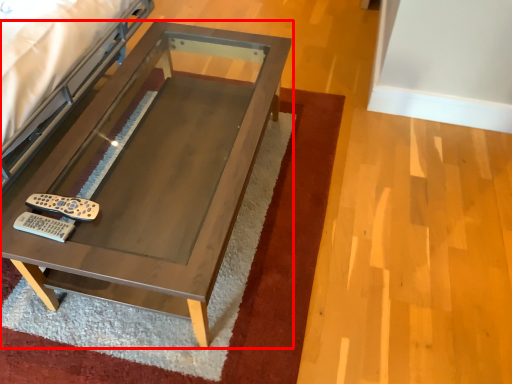
Question: From the image's perspective, where is table (annotated by the red box) located relative to remote?

Choices:
 (A) below
 (B) above

Answer: (B)